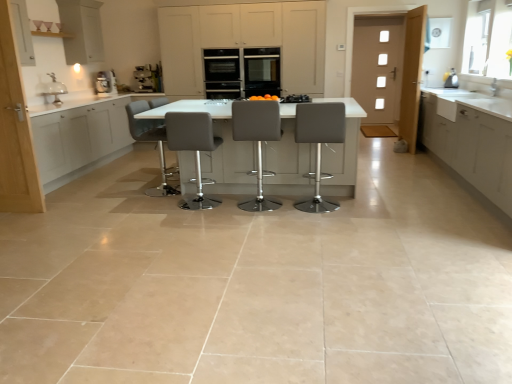
Question: In which direction should I rotate to look at satin grey bar stool at center, acting as the second chair starting from the left?

Choices:
 (A) left
 (B) right

Answer: (A)

Question: From the image's perspective, is metallic silver kettle at upper right, which ranks as the 1th appliance in right-to-left order, on top of matte white cabinet at upper left, the fifth cabinetry viewed from the right?

Choices:
 (A) no
 (B) yes

Answer: (A)

Question: From the image's perspective, is metallic silver kettle at upper right, which ranks as the 1th appliance in right-to-left order, under matte white cabinet at upper left, the fifth cabinetry viewed from the right?

Choices:
 (A) no
 (B) yes

Answer: (B)

Question: Is metallic silver kettle at upper right, marked as the second appliance in a back-to-front arrangement, completely or partially outside of matte white cabinet at upper left, the fifth cabinetry viewed from the right?

Choices:
 (A) yes
 (B) no

Answer: (A)

Question: Is metallic silver kettle at upper right, the first appliance in the front-to-back sequence, to the right of matte white cabinet at upper left, the fifth cabinetry viewed from the right, from the viewer's perspective?

Choices:
 (A) yes
 (B) no

Answer: (A)

Question: Is metallic silver kettle at upper right, the first appliance in the front-to-back sequence, bigger than matte white cabinet at upper left, which is counted as the 1th cabinetry, starting from the left?

Choices:
 (A) no
 (B) yes

Answer: (A)

Question: Does metallic silver kettle at upper right, which appears as the second appliance when viewed from the top, have a greater width compared to matte white cabinet at upper left, which is counted as the 1th cabinetry, starting from the left?

Choices:
 (A) no
 (B) yes

Answer: (A)

Question: From the image's perspective, is matte white cabinets at center, the second cabinetry from the right, on top of gray fabric stool at center, which ranks as the fourth chair in right-to-left order?

Choices:
 (A) no
 (B) yes

Answer: (B)

Question: Can you confirm if matte white cabinets at center, placed as the 4th cabinetry when sorted from left to right, is shorter than gray fabric stool at center, acting as the 1th chair starting from the left?

Choices:
 (A) yes
 (B) no

Answer: (B)

Question: Is matte white cabinets at center, the second cabinetry from the right, outside of gray fabric stool at center, acting as the 1th chair starting from the left?

Choices:
 (A) yes
 (B) no

Answer: (A)

Question: Can you confirm if matte white cabinets at center, placed as the 4th cabinetry when sorted from left to right, is thinner than gray fabric stool at center, which ranks as the fourth chair in right-to-left order?

Choices:
 (A) no
 (B) yes

Answer: (A)

Question: Considering the relative sizes of matte white cabinets at center, placed as the 4th cabinetry when sorted from left to right, and gray fabric stool at center, acting as the 1th chair starting from the left, in the image provided, is matte white cabinets at center, placed as the 4th cabinetry when sorted from left to right, smaller than gray fabric stool at center, acting as the 1th chair starting from the left,?

Choices:
 (A) yes
 (B) no

Answer: (B)

Question: Can you confirm if matte white cabinets at center, the second cabinetry from the right, is positioned to the right of gray fabric stool at center, acting as the 1th chair starting from the left?

Choices:
 (A) yes
 (B) no

Answer: (A)

Question: Does metallic silver kettle at upper right, the 2th appliance positioned from the left, have a greater height compared to grey leather stool at center, which appears as the first chair when viewed from the right?

Choices:
 (A) yes
 (B) no

Answer: (B)